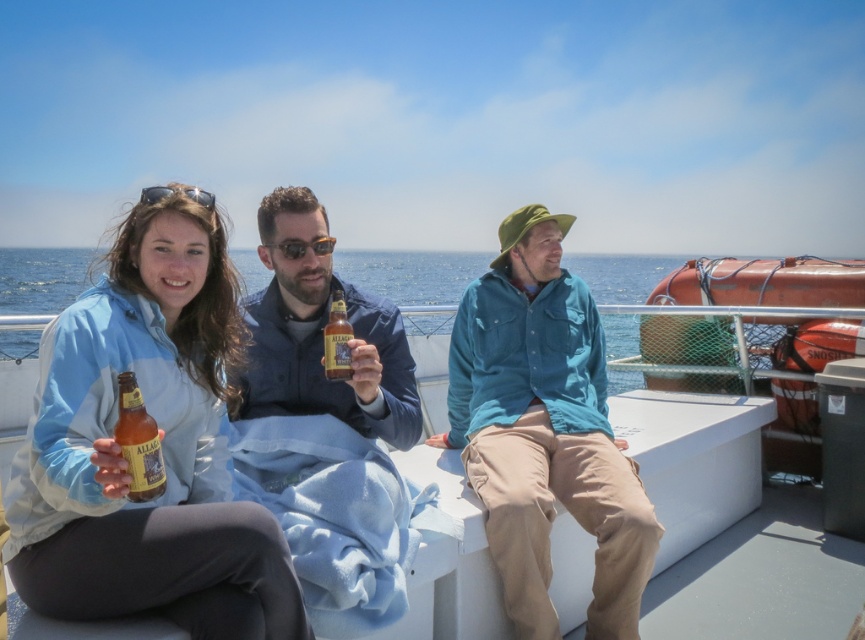
Who is positioned more to the right, teal cotton shirt at center or amber glass bottle at center?

From the viewer's perspective, teal cotton shirt at center appears more on the right side.

Who is higher up, teal cotton shirt at center or amber glass bottle at center?

amber glass bottle at center is higher up.

The height and width of the screenshot is (640, 865). Describe the element at coordinates (543, 432) in the screenshot. I see `teal cotton shirt at center` at that location.

This screenshot has width=865, height=640. I want to click on teal cotton shirt at center, so click(x=543, y=432).

Who is positioned more to the right, matte blue jacket at center or white plastic boat at center?

matte blue jacket at center

Identify the location of matte blue jacket at center. (159, 444).

Does amber glass bottle at lower left have a greater height compared to amber glass bottle at center?

Yes.

Between amber glass bottle at lower left and amber glass bottle at center, which one has less height?

With less height is amber glass bottle at center.

The height and width of the screenshot is (640, 865). Find the location of `amber glass bottle at lower left`. amber glass bottle at lower left is located at coordinates (138, 442).

I want to click on amber glass bottle at lower left, so click(138, 442).